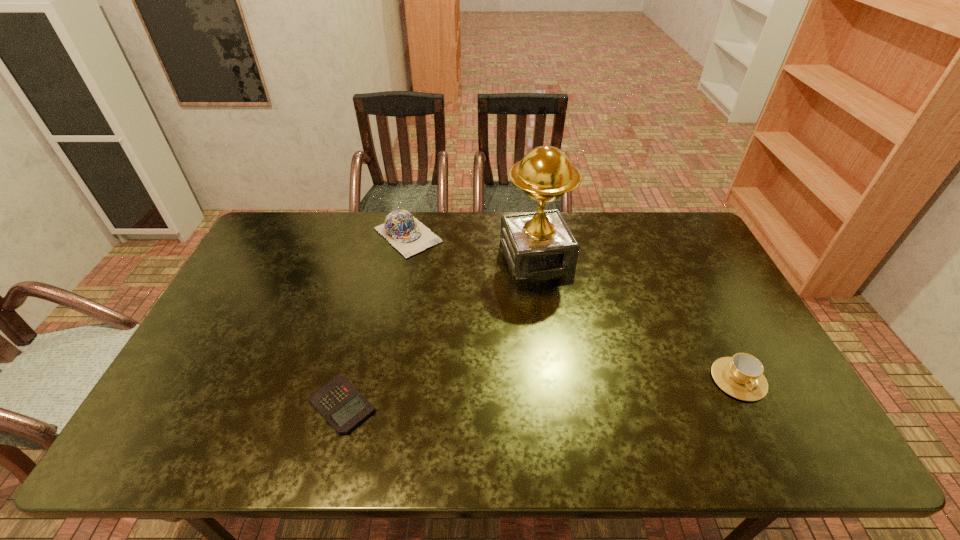
Find the location of a particular element. The width and height of the screenshot is (960, 540). the shortest object is located at coordinates (339, 402).

This screenshot has width=960, height=540. I want to click on the second shortest object, so click(741, 376).

This screenshot has width=960, height=540. I want to click on the rightmost object, so click(741, 376).

Identify the location of the second tallest object. (402, 230).

At what (x,y) coordinates should I click in order to perform the action: click on the tallest object. Please return your answer as a coordinate pair (x, y). This screenshot has height=540, width=960. Looking at the image, I should click on point(540,243).

Image resolution: width=960 pixels, height=540 pixels. In order to click on award in this screenshot , I will do `click(540, 243)`.

Find the location of `free space located 0.300m on the right of the calculator`. free space located 0.300m on the right of the calculator is located at coordinates (500, 404).

Identify the location of free space located 0.320m on the front, side, and top of the second tallest object. (488, 307).

Identify the location of vacant region located 0.090m on the front, side, and top of the second tallest object. (443, 267).

The height and width of the screenshot is (540, 960). I want to click on blank space located 0.360m on the front, side, and top of the second tallest object, so click(x=496, y=315).